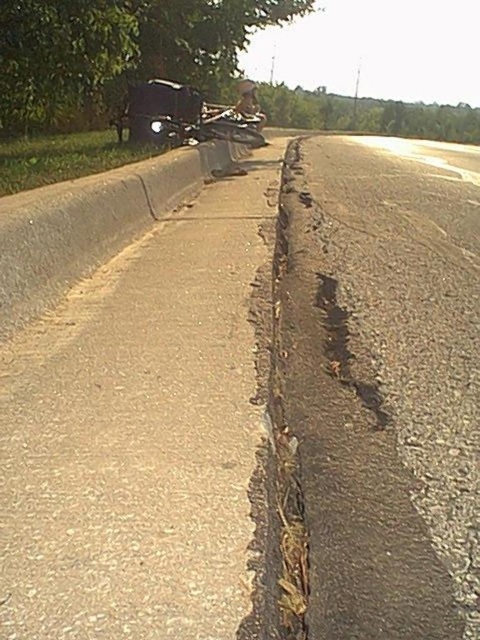
Question: Which point is farther to the camera?

Choices:
 (A) (186, 134)
 (B) (60, 100)
 (C) (239, 118)

Answer: (C)

Question: Which of the following is the closest to the observer?

Choices:
 (A) (165, 61)
 (B) (149, 122)
 (C) (211, 116)

Answer: (B)

Question: Does green leafy tree at upper center come behind metallic silver helmet at center?

Choices:
 (A) no
 (B) yes

Answer: (A)

Question: Which of the following is the closest to the observer?

Choices:
 (A) (256, 122)
 (B) (64, 83)

Answer: (B)

Question: Where is green leafy tree at upper center located in relation to shiny chrome motorcycle at center in the image?

Choices:
 (A) right
 (B) left

Answer: (B)

Question: Can you confirm if green leafy tree at upper center is smaller than shiny chrome motorcycle at center?

Choices:
 (A) yes
 (B) no

Answer: (B)